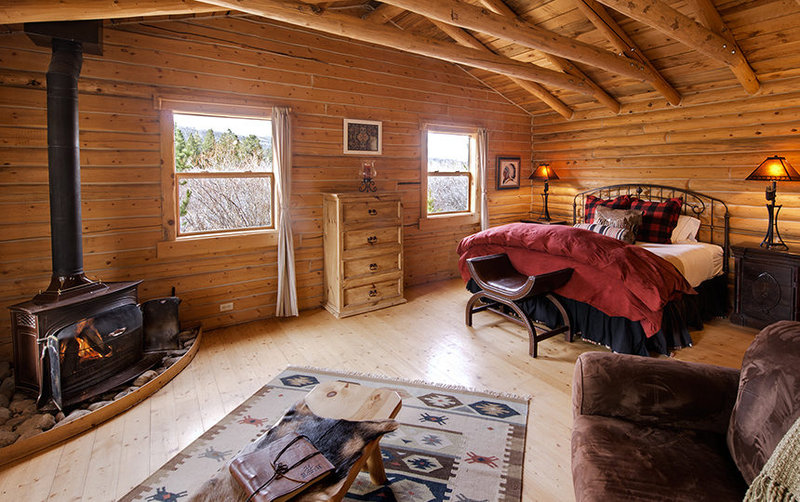
The image size is (800, 502). I want to click on chest of drawers, so click(x=378, y=253).